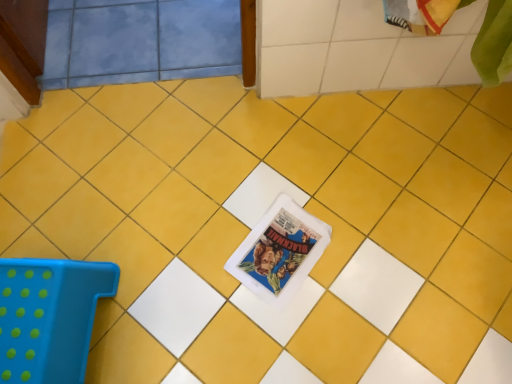
Locate an element on the screen. The width and height of the screenshot is (512, 384). vacant space situated above blue plastic stool at lower left (from a real-world perspective) is located at coordinates (27, 310).